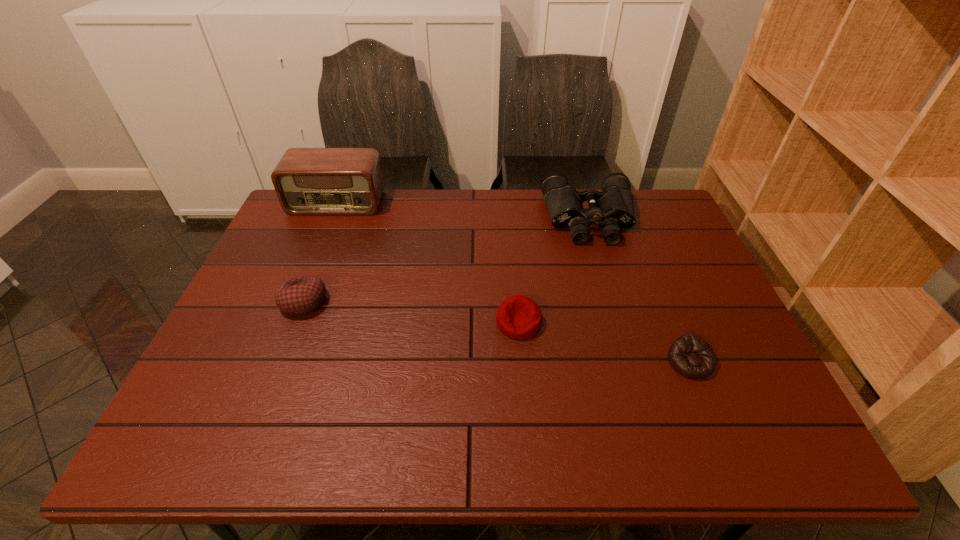
Locate an element on the screen. vacant region at the near edge of the desktop is located at coordinates (372, 423).

Locate an element on the screen. vacant space at the left edge of the desktop is located at coordinates (259, 284).

I want to click on vacant area at the right edge of the desktop, so click(660, 265).

The width and height of the screenshot is (960, 540). I want to click on vacant space at the near right corner of the desktop, so click(737, 436).

You are a GUI agent. You are given a task and a screenshot of the screen. Output one action in this format:
    pyautogui.click(x=<x>, y=<y>)
    Task: Click on the unoccupied area between the tallest object and the second tallest object
    The height and width of the screenshot is (540, 960).
    Given the screenshot: What is the action you would take?
    pyautogui.click(x=463, y=211)

Identify the location of free space between the radio receiver and the third object from left to right. (427, 262).

At what (x,y) coordinates should I click in order to perform the action: click on empty location between the leftmost beanbag and the radio receiver. Please return your answer as a coordinate pair (x, y). Looking at the image, I should click on (321, 252).

You are a GUI agent. You are given a task and a screenshot of the screen. Output one action in this format:
    pyautogui.click(x=<x>, y=<y>)
    Task: Click on the free area in between the second beanbag from right to left and the radio receiver
    This screenshot has width=960, height=540.
    Given the screenshot: What is the action you would take?
    pyautogui.click(x=427, y=262)

You are a GUI agent. You are given a task and a screenshot of the screen. Output one action in this format:
    pyautogui.click(x=<x>, y=<y>)
    Task: Click on the free area in between the nearest object and the second beanbag from left to right
    
    Given the screenshot: What is the action you would take?
    pyautogui.click(x=604, y=342)

Locate an element on the screen. This screenshot has height=540, width=960. vacant area that lies between the shortest object and the leftmost beanbag is located at coordinates pos(496,332).